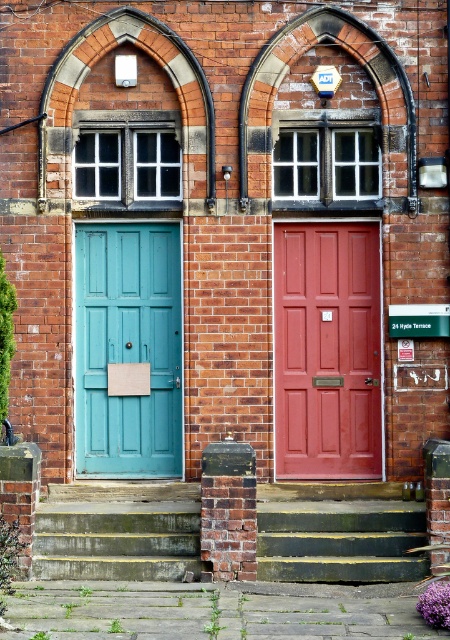
Is matte red door at center behind green painted wood stairs at center?

That is True.

Between point (343, 291) and point (340, 570), which one is positioned behind?

The point (343, 291) is behind.

Where is `matte red door at center`? The image size is (450, 640). matte red door at center is located at coordinates (327, 349).

Is matte red door at center in front of teal matte door at left?

Yes, matte red door at center is in front of teal matte door at left.

Can you confirm if matte red door at center is bigger than teal matte door at left?

Actually, matte red door at center might be smaller than teal matte door at left.

Where is `matte red door at center`? matte red door at center is located at coordinates (327, 349).

Measure the distance between green painted wood stairs at center and concrete steps at center.

3.73 feet

Is green painted wood stairs at center bigger than concrete steps at center?

Yes.

I want to click on green painted wood stairs at center, so click(x=337, y=532).

Where is `green painted wood stairs at center`? The image size is (450, 640). green painted wood stairs at center is located at coordinates (337, 532).